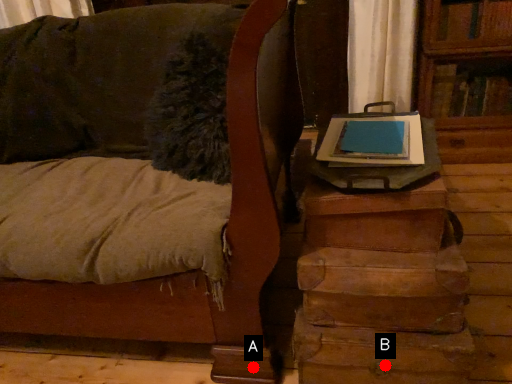
Question: Two points are circled on the image, labeled by A and B beside each circle. Which point is closer to the camera?

Choices:
 (A) A is closer
 (B) B is closer

Answer: (B)